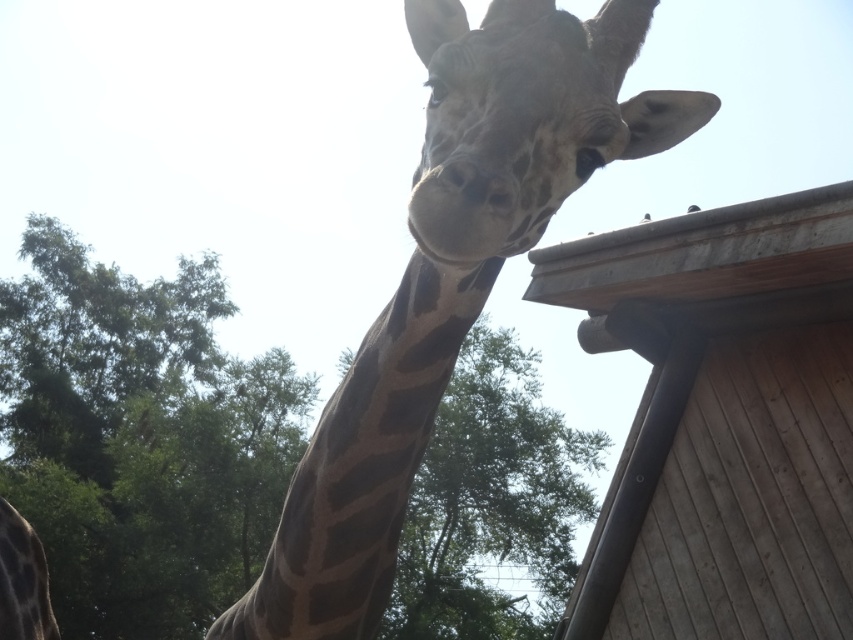
You are a photographer standing in front of the spotted fur giraffe at center and the green leafy tree at upper left. Which object is closer to you?

The green leafy tree at upper left is closer to you because it is positioned in front of the spotted fur giraffe at center.

You are a photographer trying to capture a clear shot of the spotted fur giraffe at center. However, there is a wooden hut at upper right in the way. Can you adjust your position to take the photo without the hut blocking the view?

The spotted fur giraffe at center is behind the wooden hut at upper right, so moving your position slightly to the left or right might allow you to capture the giraffe without the hut blocking the view.